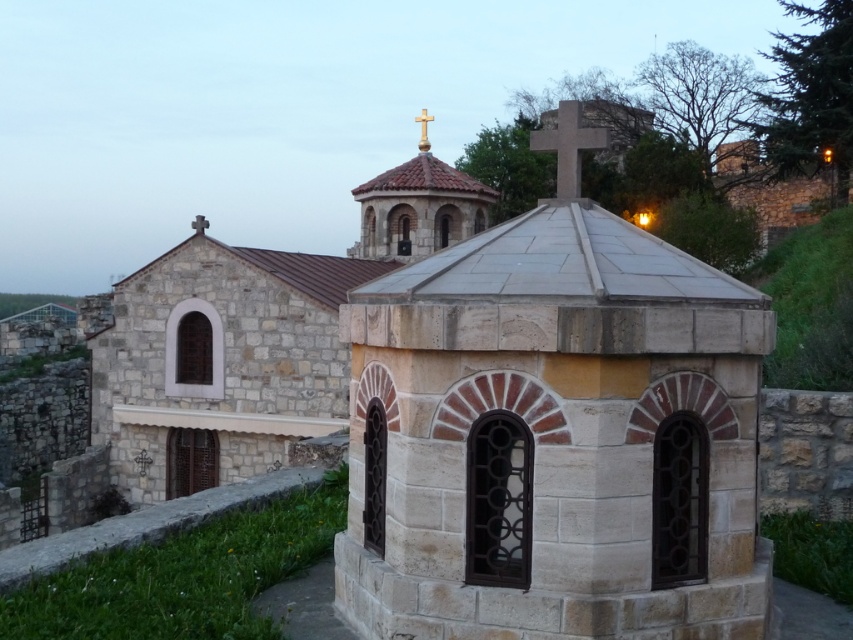
You are standing in the historic setting described. There is a point marked at coordinates (x=567, y=145). What object is located at this point?

The point at coordinates (x=567, y=145) corresponds to the smooth stone cross at upper center.

Consider the image. You are standing in front of the small stone chapel and looking towards the larger stone building in the background. Where is the smooth stone cross at upper center located in relation to the two buildings?

The smooth stone cross at upper center is located at point [567,145], which is in the upper central area between the small stone chapel in the foreground and the larger stone building in the background.